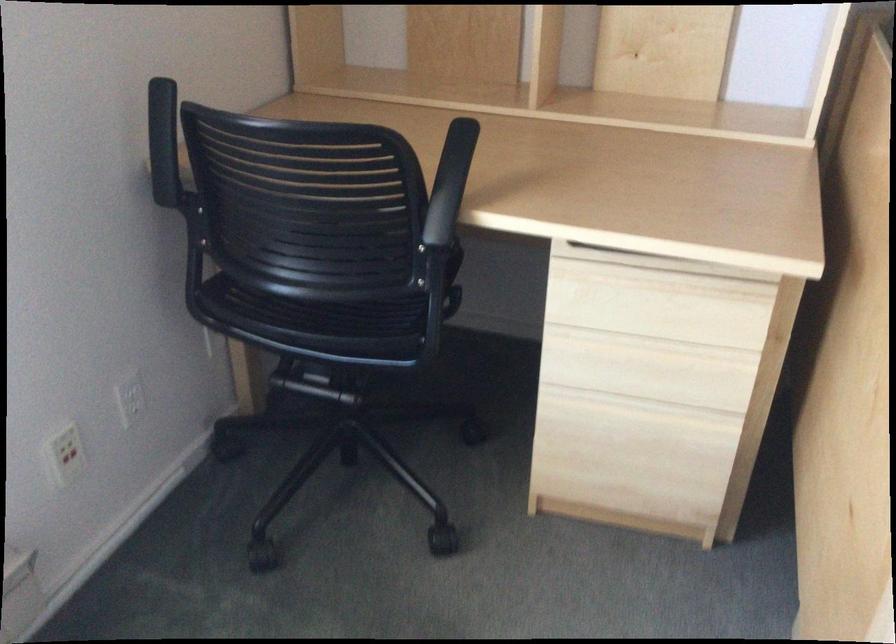
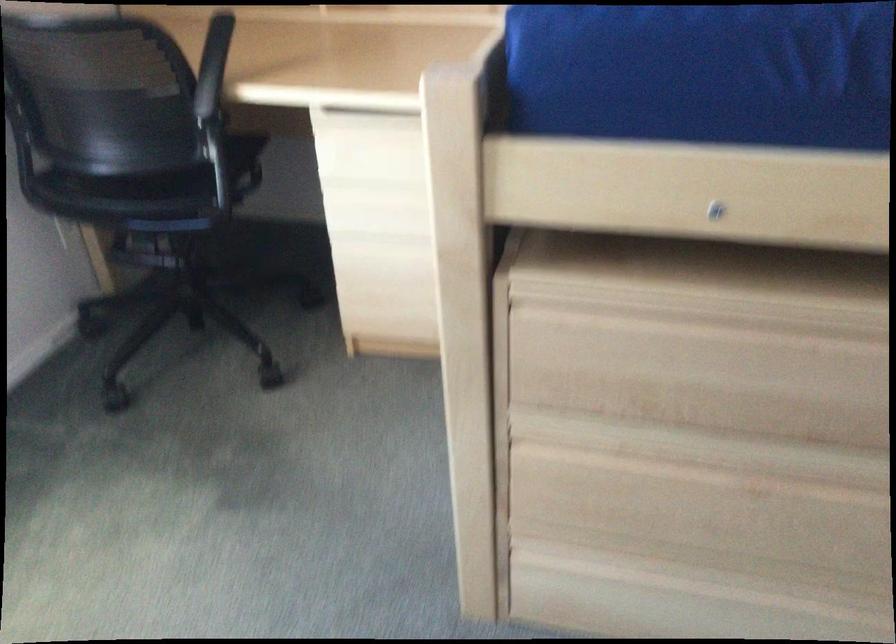
In the second image, find the point that corresponds to point 615,259 in the first image.

(364, 117)